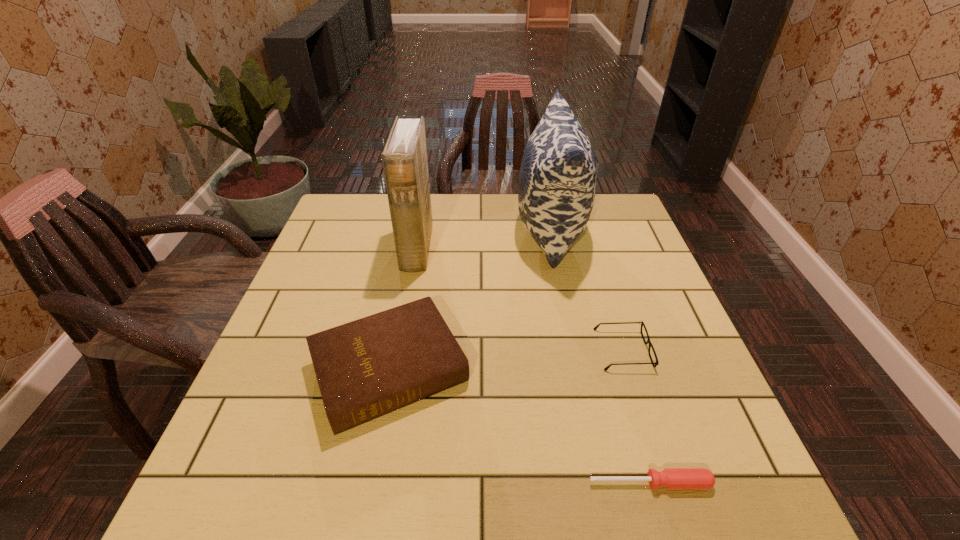
This screenshot has width=960, height=540. What are the coordinates of `object that is at the near right corner` in the screenshot? It's located at [670, 478].

What are the coordinates of `free space at the far edge of the desktop` in the screenshot? It's located at (492, 212).

Locate an element on the screen. This screenshot has height=540, width=960. vacant area at the near edge is located at coordinates (547, 483).

Locate an element on the screen. Image resolution: width=960 pixels, height=540 pixels. free space at the left edge is located at coordinates (298, 431).

The height and width of the screenshot is (540, 960). Identify the location of vacant space at the right edge of the desktop. (650, 359).

I want to click on vacant region at the far right corner, so click(620, 228).

In the image, there is a desktop. Find the location of `free region at the near right corner`. free region at the near right corner is located at coordinates (732, 472).

You are a GUI agent. You are given a task and a screenshot of the screen. Output one action in this format:
    pyautogui.click(x=<x>, y=<y>)
    Task: Click on the empty space between the third shortest object and the cushion
    This screenshot has width=960, height=540.
    Given the screenshot: What is the action you would take?
    pyautogui.click(x=470, y=300)

You are a GUI agent. You are given a task and a screenshot of the screen. Output one action in this format:
    pyautogui.click(x=<x>, y=<y>)
    Task: Click on the free space between the cushion and the spectacles
    Image resolution: width=960 pixels, height=540 pixels.
    Given the screenshot: What is the action you would take?
    pyautogui.click(x=587, y=290)

Find the location of a particular element. This screenshot has width=960, height=540. vacant point located between the spectacles and the Bible is located at coordinates (507, 360).